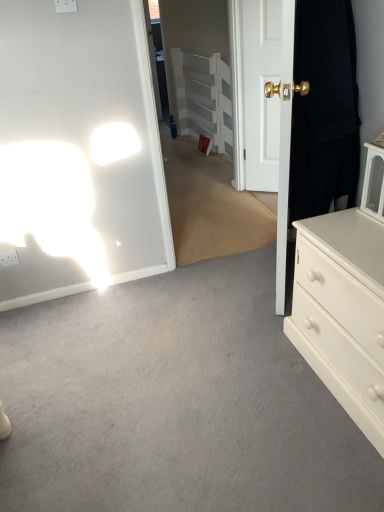
Question: Does black fabric door at right, positioned as the 2th door in back-to-front order, have a larger size compared to clear glass door at center?

Choices:
 (A) yes
 (B) no

Answer: (B)

Question: Is the position of black fabric door at right, acting as the first door starting from the front, more distant than that of clear glass door at center?

Choices:
 (A) yes
 (B) no

Answer: (B)

Question: Considering the relative sizes of black fabric door at right, positioned as the 2th door in back-to-front order, and clear glass door at center in the image provided, is black fabric door at right, positioned as the 2th door in back-to-front order, wider than clear glass door at center?

Choices:
 (A) no
 (B) yes

Answer: (B)

Question: Is black fabric door at right, acting as the first door starting from the front, shorter than clear glass door at center?

Choices:
 (A) no
 (B) yes

Answer: (B)

Question: Is the surface of black fabric door at right, acting as the first door starting from the front, in direct contact with clear glass door at center?

Choices:
 (A) no
 (B) yes

Answer: (A)

Question: Is clear glass door at center bigger or smaller than white painted wood armoire at center?

Choices:
 (A) big
 (B) small

Answer: (B)

Question: From their relative heights in the image, would you say clear glass door at center is taller or shorter than white painted wood armoire at center?

Choices:
 (A) tall
 (B) short

Answer: (A)

Question: Is clear glass door at center wider or thinner than white painted wood armoire at center?

Choices:
 (A) wide
 (B) thin

Answer: (B)

Question: In the image, is clear glass door at center positioned in front of or behind white painted wood armoire at center?

Choices:
 (A) front
 (B) behind

Answer: (A)

Question: Considering the positions of black fabric door at right, acting as the first door starting from the front, and white painted wood armoire at center in the image, is black fabric door at right, acting as the first door starting from the front, bigger or smaller than white painted wood armoire at center?

Choices:
 (A) big
 (B) small

Answer: (B)

Question: From a real-world perspective, relative to white painted wood armoire at center, is black fabric door at right, acting as the first door starting from the front, vertically above or below?

Choices:
 (A) above
 (B) below

Answer: (A)

Question: From the image's perspective, is black fabric door at right, acting as the first door starting from the front, positioned above or below white painted wood armoire at center?

Choices:
 (A) below
 (B) above

Answer: (A)

Question: From their relative heights in the image, would you say black fabric door at right, acting as the first door starting from the front, is taller or shorter than white painted wood armoire at center?

Choices:
 (A) short
 (B) tall

Answer: (A)

Question: From the image's perspective, is white glossy door at center, arranged as the 2th door when viewed from the front, positioned above or below white painted wood armoire at center?

Choices:
 (A) above
 (B) below

Answer: (B)

Question: Looking at the image, does white glossy door at center, arranged as the 2th door when viewed from the front, seem bigger or smaller compared to white painted wood armoire at center?

Choices:
 (A) small
 (B) big

Answer: (A)